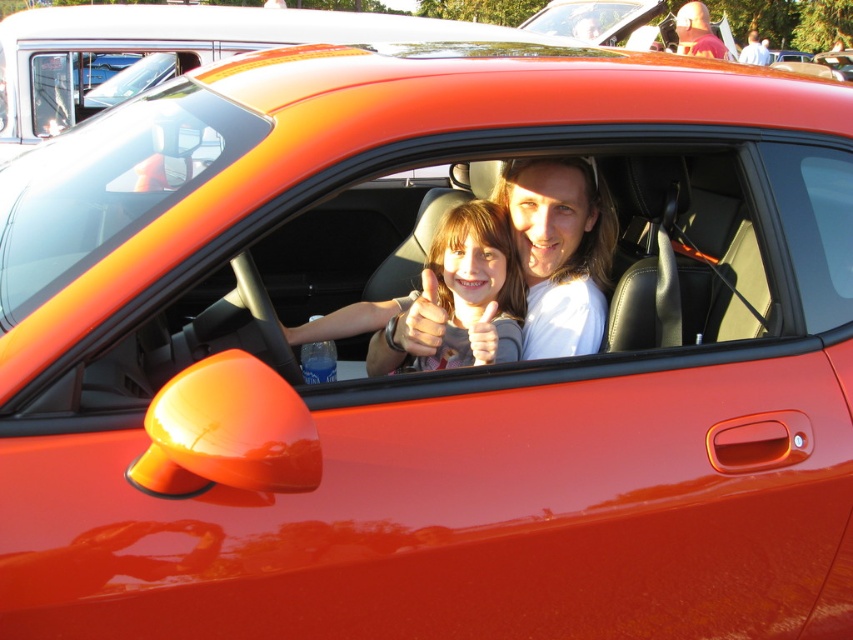
You are trying to decide which clothing item to take from the car for a quick errand. You see the matte white shirt at center and the matte pink sweater at center. Which one is smaller and easier to grab quickly?

The matte white shirt at center is smaller than the matte pink sweater at center, so it would be easier to grab quickly.

What is the exact coordinate of the matte white shirt at center?

The matte white shirt at center is located at point (560,252).

You are a photographer taking a picture of the two people inside the car. You notice the matte white shirt at center and the matte pink sweater at center. Which one should you adjust to ensure both are visible in the frame?

The matte white shirt at center is taller than the matte pink sweater at center. To ensure both are visible, you should lower the matte white shirt at center or raise the matte pink sweater at center so they are at the same height.